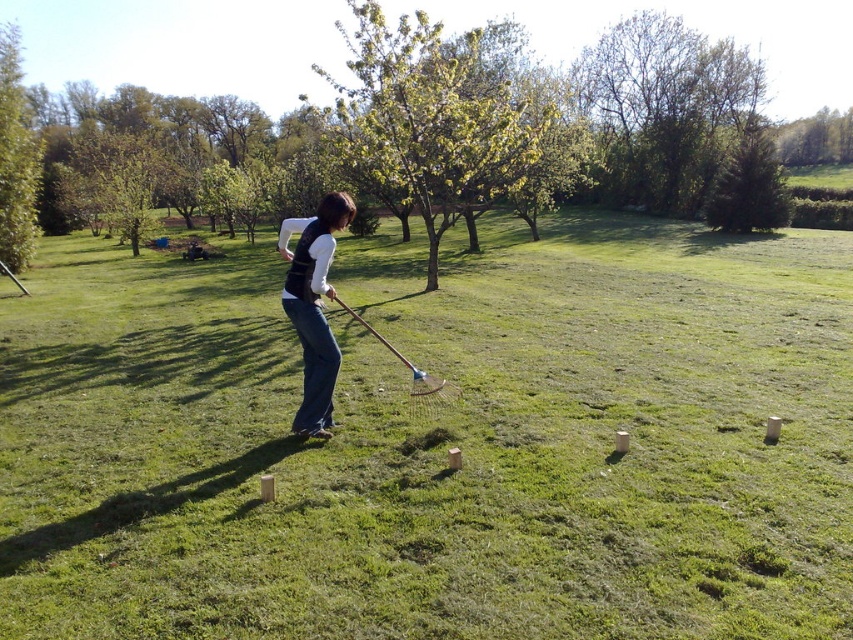
You are a gardener who needs to plant a flower in the green grass at center. However, you notice the denim jeans at center might be in the way. Which area should you avoid stepping on to ensure you don work on the wrong spot?

You should avoid stepping on the denim jeans at center because the green grass at center is bigger and more suitable for planting the flower.

You are standing in the grassy field and see the green grass at center and the denim jeans at center. Which object is located to the right of the other?

The green grass at center is positioned on the right side of denim jeans at center.